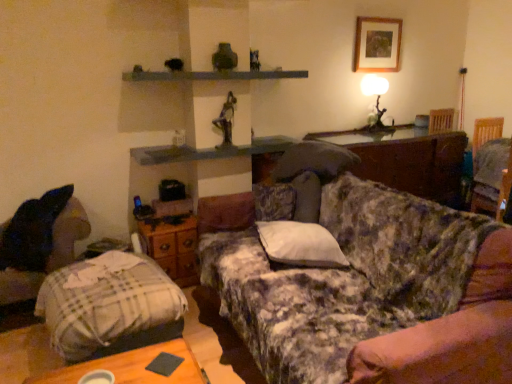
Question: Would you say fluffy white pillow at right, which is counted as the 1th pillow, starting from the top, is outside matte white wood table lamp at upper right?

Choices:
 (A) no
 (B) yes

Answer: (B)

Question: Is fluffy white pillow at right, positioned as the second pillow in front-to-back order, next to matte white wood table lamp at upper right and touching it?

Choices:
 (A) yes
 (B) no

Answer: (B)

Question: Is the position of fluffy white pillow at right, which appears as the 2th pillow when ordered from the bottom, less distant than that of matte white wood table lamp at upper right?

Choices:
 (A) yes
 (B) no

Answer: (A)

Question: Is fluffy white pillow at right, which is counted as the 1th pillow, starting from the top, further to camera compared to matte white wood table lamp at upper right?

Choices:
 (A) no
 (B) yes

Answer: (A)

Question: Is fluffy white pillow at right, positioned as the second pillow in front-to-back order, far from matte white wood table lamp at upper right?

Choices:
 (A) yes
 (B) no

Answer: (B)

Question: Is floral fabric couch at center bigger or smaller than wooden drawer at center?

Choices:
 (A) small
 (B) big

Answer: (B)

Question: From the image's perspective, relative to wooden drawer at center, is floral fabric couch at center above or below?

Choices:
 (A) above
 (B) below

Answer: (B)

Question: Based on their positions, is floral fabric couch at center located to the left or right of wooden drawer at center?

Choices:
 (A) right
 (B) left

Answer: (A)

Question: Considering the positions of floral fabric couch at center and wooden drawer at center in the image, is floral fabric couch at center taller or shorter than wooden drawer at center?

Choices:
 (A) short
 (B) tall

Answer: (B)

Question: Looking at the image, does wooden picture frame at upper right seem bigger or smaller compared to dark wood swivel chair at right, acting as the second swivel chair starting from the front?

Choices:
 (A) small
 (B) big

Answer: (A)

Question: From the image's perspective, is wooden picture frame at upper right above or below dark wood swivel chair at right, which is counted as the 1th swivel chair, starting from the right?

Choices:
 (A) above
 (B) below

Answer: (A)

Question: Considering the positions of wooden picture frame at upper right and dark wood swivel chair at right, which is counted as the 1th swivel chair, starting from the right, in the image, is wooden picture frame at upper right taller or shorter than dark wood swivel chair at right, which is counted as the 1th swivel chair, starting from the right,?

Choices:
 (A) short
 (B) tall

Answer: (A)

Question: Is wooden picture frame at upper right spatially inside dark wood swivel chair at right, the first swivel chair viewed from the top, or outside of it?

Choices:
 (A) outside
 (B) inside

Answer: (A)

Question: In the image, is wooden table at center on the left side or the right side of dark fabric swivel chair at lower left, which appears as the second swivel chair when viewed from the right?

Choices:
 (A) left
 (B) right

Answer: (B)

Question: Considering the positions of wooden table at center and dark fabric swivel chair at lower left, acting as the first swivel chair starting from the left, in the image, is wooden table at center taller or shorter than dark fabric swivel chair at lower left, acting as the first swivel chair starting from the left,?

Choices:
 (A) tall
 (B) short

Answer: (B)